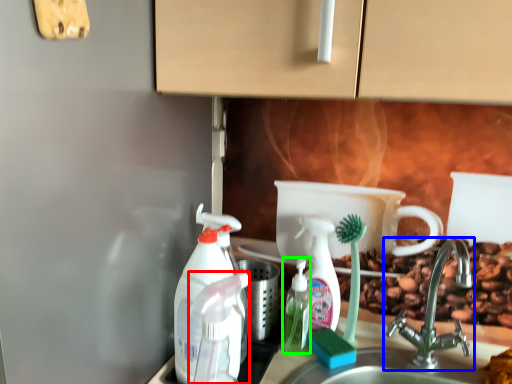
Question: Based on their relative distances, which object is farther from cleaning product (highlighted by a red box)? Choose from tap (highlighted by a blue box) and bottle (highlighted by a green box).

Choices:
 (A) tap
 (B) bottle

Answer: (A)